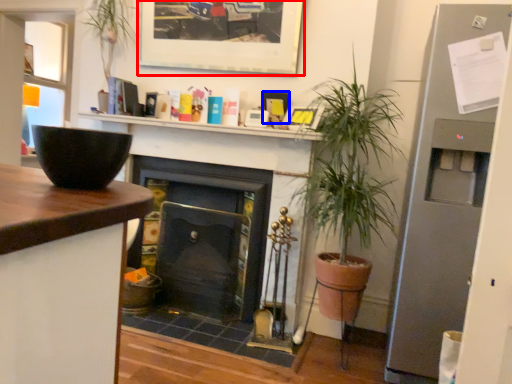
Question: Which object is closer to the camera taking this photo, picture frame (highlighted by a red box) or picture frame (highlighted by a blue box)?

Choices:
 (A) picture frame
 (B) picture frame

Answer: (A)